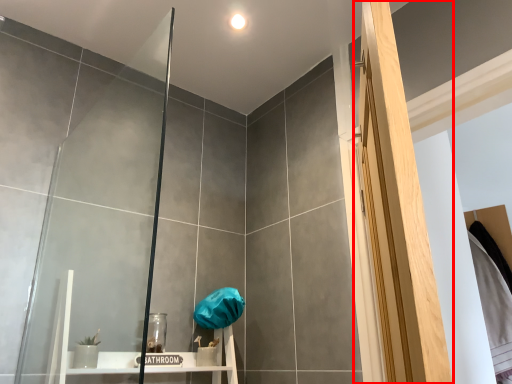
Question: In this image, where is screen door (annotated by the red box) located relative to glass door?

Choices:
 (A) left
 (B) right

Answer: (B)